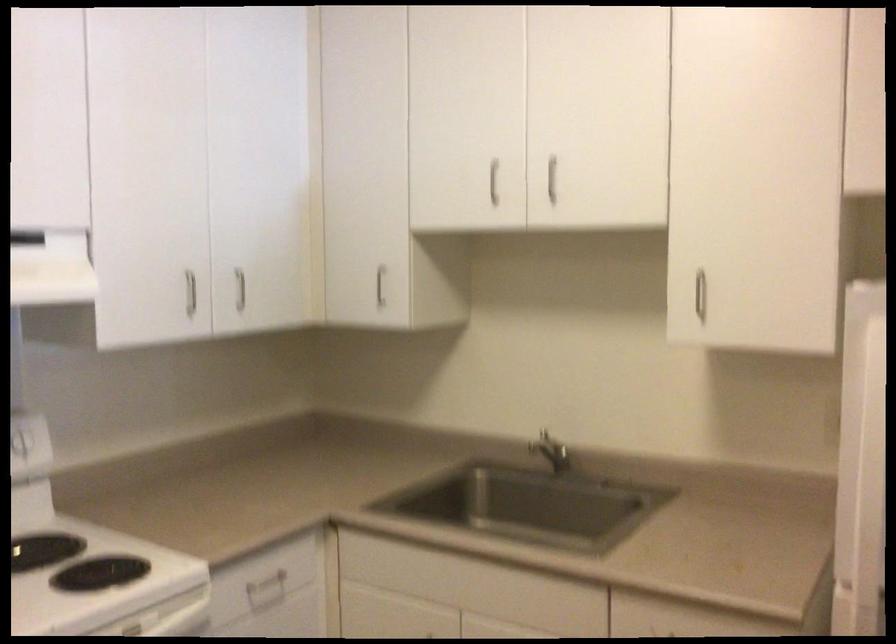
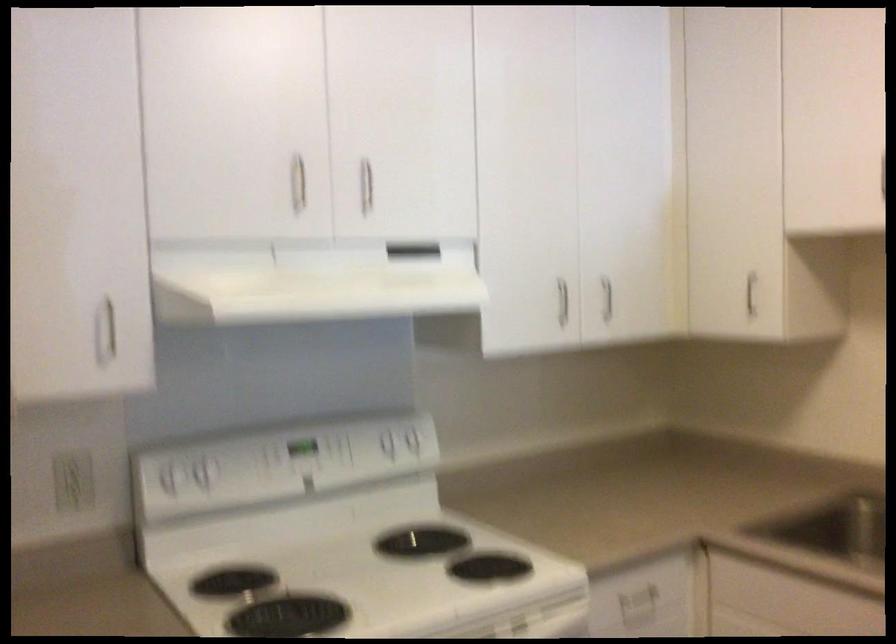
Find the pixel in the second image that matches pixel 376 279 in the first image.

(751, 292)